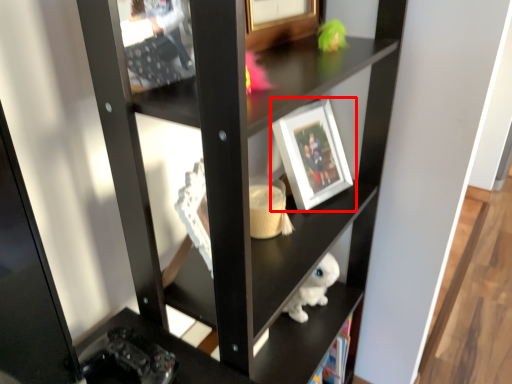
Question: From the image, what is the correct spatial relationship of picture frame (annotated by the red box) in relation to shelf?

Choices:
 (A) left
 (B) right

Answer: (B)